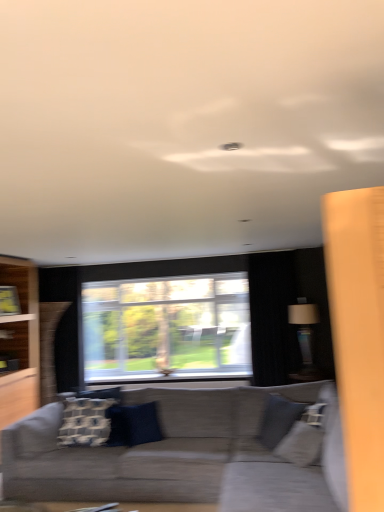
Question: Are gray fabric swivel chair at lower right and textured gray couch at center beside each other?

Choices:
 (A) yes
 (B) no

Answer: (B)

Question: From a real-world perspective, is gray fabric swivel chair at lower right on top of textured gray couch at center?

Choices:
 (A) no
 (B) yes

Answer: (B)

Question: Can you confirm if gray fabric swivel chair at lower right is bigger than textured gray couch at center?

Choices:
 (A) no
 (B) yes

Answer: (A)

Question: Is gray fabric swivel chair at lower right to the left of textured gray couch at center from the viewer's perspective?

Choices:
 (A) yes
 (B) no

Answer: (B)

Question: From a real-world perspective, is gray fabric swivel chair at lower right below textured gray couch at center?

Choices:
 (A) no
 (B) yes

Answer: (A)

Question: Does gray fabric swivel chair at lower right have a lesser height compared to textured gray couch at center?

Choices:
 (A) no
 (B) yes

Answer: (A)

Question: Is blue velvet pillow at center, which appears as the second pillow when viewed from the left, outside textured gray couch at center?

Choices:
 (A) no
 (B) yes

Answer: (A)

Question: Does blue velvet pillow at center, which is the first pillow in right-to-left order, have a greater width compared to textured gray couch at center?

Choices:
 (A) no
 (B) yes

Answer: (A)

Question: Would you say blue velvet pillow at center, which is the first pillow in right-to-left order, contains textured gray couch at center?

Choices:
 (A) no
 (B) yes

Answer: (A)

Question: Is blue velvet pillow at center, which appears as the second pillow when viewed from the left, thinner than textured gray couch at center?

Choices:
 (A) yes
 (B) no

Answer: (A)

Question: From a real-world perspective, is blue velvet pillow at center, which appears as the second pillow when viewed from the left, located beneath textured gray couch at center?

Choices:
 (A) yes
 (B) no

Answer: (B)

Question: From the image's perspective, is blue velvet pillow at center, which appears as the second pillow when viewed from the left, located above textured gray couch at center?

Choices:
 (A) yes
 (B) no

Answer: (B)

Question: Considering the relative sizes of white textured pillow at center, which is counted as the first pillow, starting from the left, and gray fabric swivel chair at lower right in the image provided, is white textured pillow at center, which is counted as the first pillow, starting from the left, bigger than gray fabric swivel chair at lower right?

Choices:
 (A) yes
 (B) no

Answer: (B)